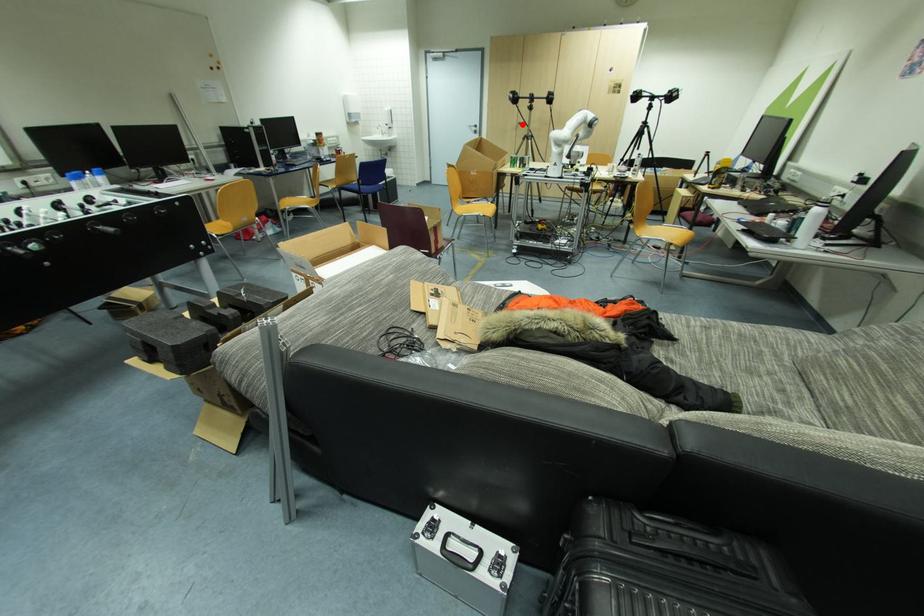
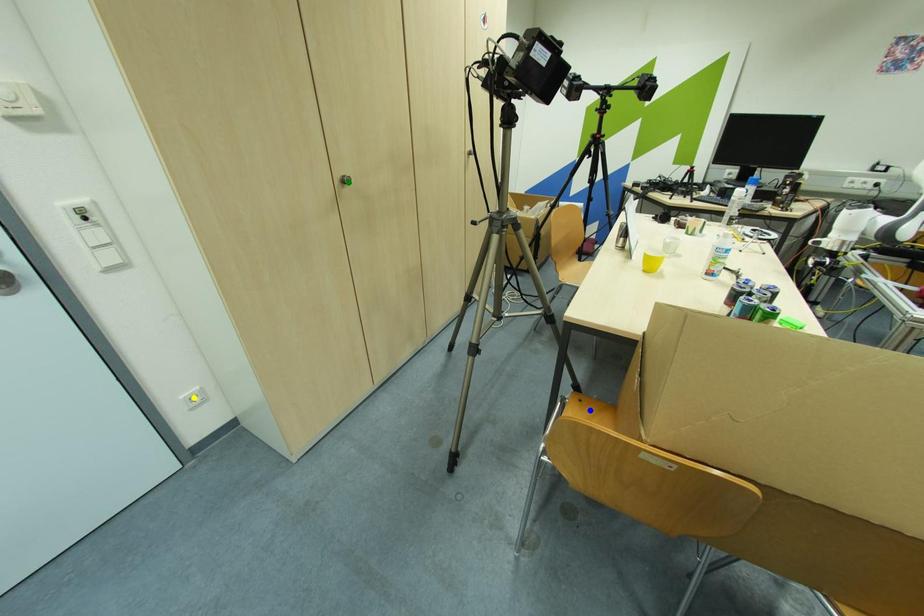
Question: I am providing you with two images of the same scene from different viewpoints. A red point is marked on the first image. You are given multiple points on the second image. Can you choose the point in image 2 that corresponds to the point in image 1?

Choices:
 (A) green point
 (B) blue point
 (C) yellow point

Answer: (A)